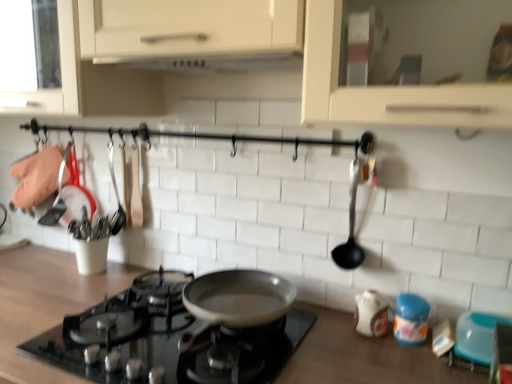
Find the location of a particular element. The image size is (512, 384). vacant space in between black glass gas stove at center and blue plastic container at lower right, marked as the second appliance in a right-to-left arrangement is located at coordinates (342, 348).